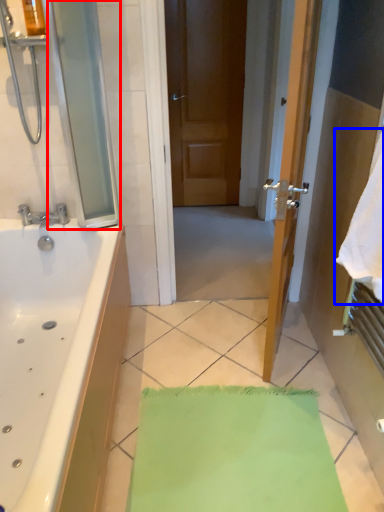
Question: Which point is further to the camera, screen door (highlighted by a red box) or beach towel (highlighted by a blue box)?

Choices:
 (A) screen door
 (B) beach towel

Answer: (A)